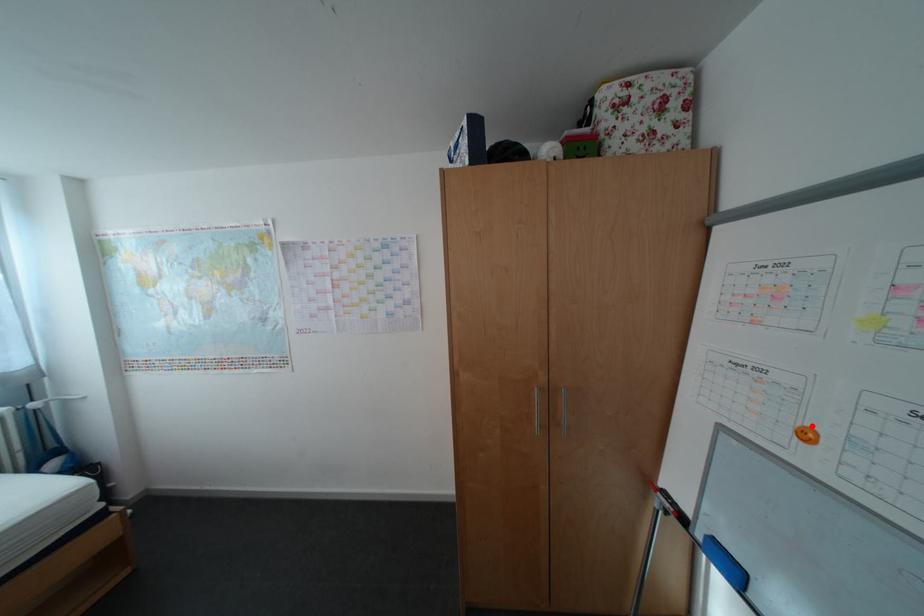
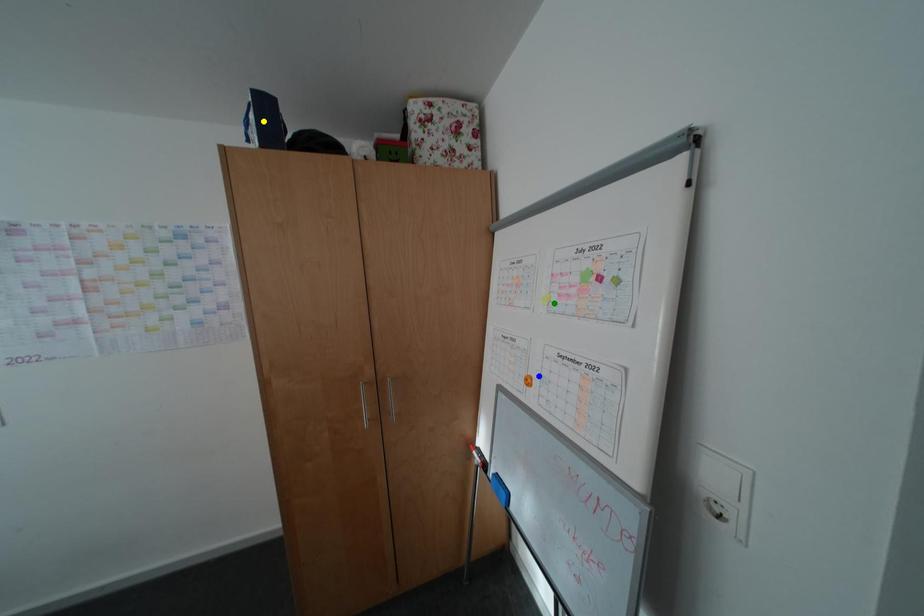
Question: I am providing you with two images of the same scene from different viewpoints. A red point is marked on the first image. You are given multiple points on the second image. Which point in image 2 is actually the same real-world point as the red point in image 1?

Choices:
 (A) yellow point
 (B) green point
 (C) blue point

Answer: (C)